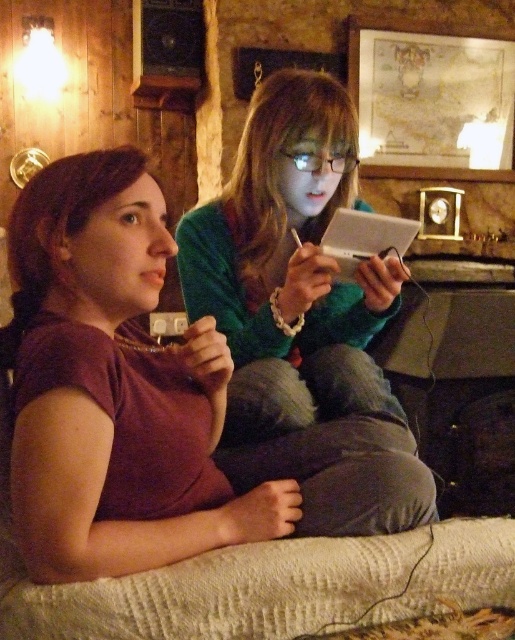
Question: Among these points, which one is nearest to the camera?

Choices:
 (A) (73, 410)
 (B) (347, 164)

Answer: (A)

Question: Which point is farther from the camera taking this photo?

Choices:
 (A) (114, 225)
 (B) (273, 124)

Answer: (B)

Question: Considering the relative positions of matte purple shirt at center and green matte sweater at center in the image provided, where is matte purple shirt at center located with respect to green matte sweater at center?

Choices:
 (A) left
 (B) right

Answer: (A)

Question: Which object is farther from the camera taking this photo?

Choices:
 (A) green matte sweater at center
 (B) matte purple shirt at center

Answer: (A)

Question: Does matte purple shirt at center appear on the right side of green matte sweater at center?

Choices:
 (A) yes
 (B) no

Answer: (B)

Question: Does matte purple shirt at center have a lesser width compared to green matte sweater at center?

Choices:
 (A) yes
 (B) no

Answer: (B)